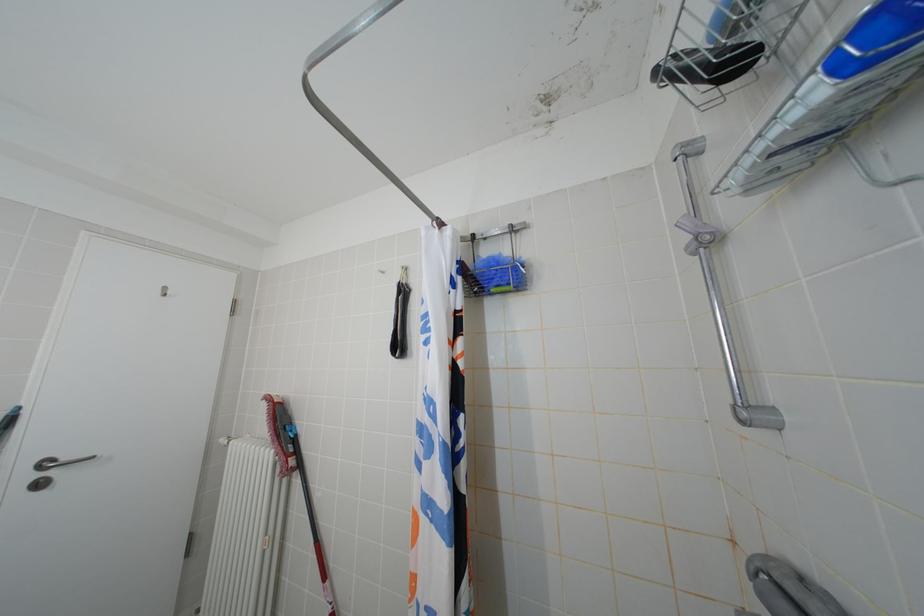
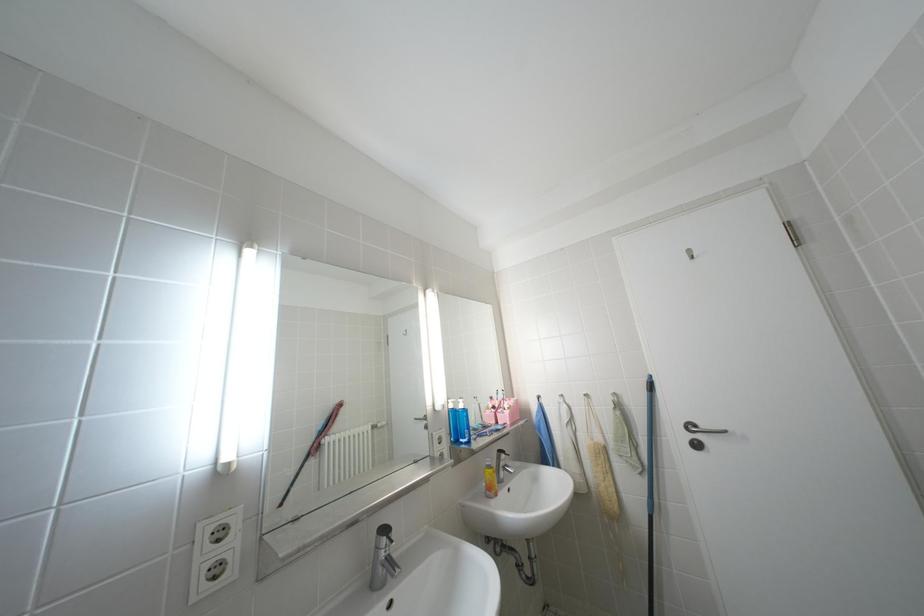
Based on the continuous images, in which direction is the camera rotating?

The camera rotated toward left-up.